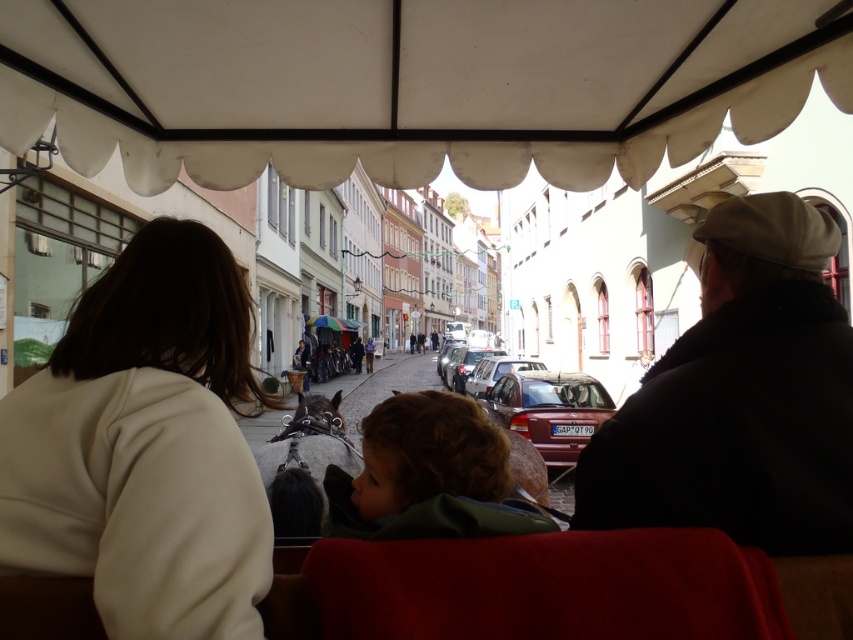
You are a photographer standing inside the horse drawn carriage. You want to take a photo of the beige fleece jacket at left and the satin silver car at center. Which object should you zoom in more on to capture both in the frame without cropping?

Since the beige fleece jacket at left is smaller than the satin silver car at center, you should zoom in more on the beige fleece jacket at left to ensure both fit in the frame without cropping.

You are a passenger in the horse carriage and want to know if the shiny red car at center is protected from the rain by the white fabric canopy at upper center. Is it?

The white fabric canopy at upper center is above the shiny red car at center, so yes, the shiny red car at center is protected from the rain by the white fabric canopy at upper center.

Looking at this image, you are a passenger in the carriage and want to look at the view outside. Which object, the white fabric canopy at upper center or the dark brown leather coach at center, is positioned to the left when facing forward?

The white fabric canopy at upper center is positioned to the left of the dark brown leather coach at center when facing forward.